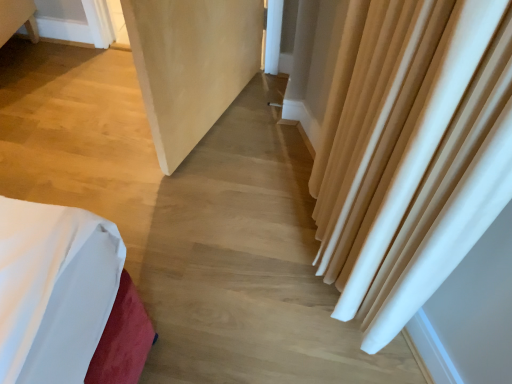
This screenshot has height=384, width=512. What do you see at coordinates (191, 65) in the screenshot? I see `matte white screen door at center` at bounding box center [191, 65].

Find the location of `matte white screen door at center`. matte white screen door at center is located at coordinates (191, 65).

This screenshot has height=384, width=512. What are the coordinates of `beige fabric curtain at right` in the screenshot? It's located at (411, 154).

This screenshot has height=384, width=512. What do you see at coordinates (411, 154) in the screenshot? I see `beige fabric curtain at right` at bounding box center [411, 154].

The width and height of the screenshot is (512, 384). In order to click on matte white screen door at center in this screenshot , I will do `click(191, 65)`.

Does matte white screen door at center appear on the left side of beige fabric curtain at right?

Correct, you'll find matte white screen door at center to the left of beige fabric curtain at right.

In the image, is matte white screen door at center positioned in front of or behind beige fabric curtain at right?

Visually, matte white screen door at center is located in front of beige fabric curtain at right.

Considering the points (198, 118) and (489, 223), which point is in front, point (198, 118) or point (489, 223)?

Point (489, 223)

From the image's perspective, is matte white screen door at center below beige fabric curtain at right?

Incorrect, from the image's perspective, matte white screen door at center is higher than beige fabric curtain at right.

From a real-world perspective, is matte white screen door at center positioned under beige fabric curtain at right based on gravity?

Incorrect, from a real-world perspective, matte white screen door at center is higher than beige fabric curtain at right.

Which object is thinner, matte white screen door at center or beige fabric curtain at right?

beige fabric curtain at right.

Considering the sizes of objects matte white screen door at center and beige fabric curtain at right in the image provided, who is taller, matte white screen door at center or beige fabric curtain at right?

With more height is matte white screen door at center.

Based on their sizes in the image, would you say matte white screen door at center is bigger or smaller than beige fabric curtain at right?

matte white screen door at center is bigger than beige fabric curtain at right.

Is matte white screen door at center spatially inside beige fabric curtain at right, or outside of it?

matte white screen door at center is outside beige fabric curtain at right.

Is matte white screen door at center next to beige fabric curtain at right?

They are not placed beside each other.

Is matte white screen door at center aimed at beige fabric curtain at right?

No, matte white screen door at center is not aimed at beige fabric curtain at right.

What's the angular difference between matte white screen door at center and beige fabric curtain at right's facing directions?

The facing directions of matte white screen door at center and beige fabric curtain at right are 43.4 degrees apart.

How distant is matte white screen door at center from beige fabric curtain at right?

They are 31.48 inches apart.

Where is `curtain below the matte white screen door at center (from the image's perspective)`? This screenshot has height=384, width=512. curtain below the matte white screen door at center (from the image's perspective) is located at coordinates (411, 154).

Consider the image. Does beige fabric curtain at right appear on the left side of matte white screen door at center?

No, beige fabric curtain at right is not to the left of matte white screen door at center.

Considering their positions, is beige fabric curtain at right located in front of or behind matte white screen door at center?

beige fabric curtain at right is positioned farther from the viewer than matte white screen door at center.

Does point (441, 165) appear closer or farther from the camera than point (174, 30)?

Point (441, 165) is positioned closer to the camera compared to point (174, 30).

From the image's perspective, does beige fabric curtain at right appear lower than matte white screen door at center?

Indeed, from the image's perspective, beige fabric curtain at right is shown beneath matte white screen door at center.

From a real-world perspective, is beige fabric curtain at right positioned over matte white screen door at center based on gravity?

No, from a real-world perspective, beige fabric curtain at right is not over matte white screen door at center

Is beige fabric curtain at right wider or thinner than matte white screen door at center?

In the image, beige fabric curtain at right appears to be more narrow than matte white screen door at center.

Is beige fabric curtain at right taller than matte white screen door at center?

Incorrect, the height of beige fabric curtain at right is not larger of that of matte white screen door at center.

Is beige fabric curtain at right bigger than matte white screen door at center?

Incorrect, beige fabric curtain at right is not larger than matte white screen door at center.

Would you say beige fabric curtain at right is inside or outside matte white screen door at center?

beige fabric curtain at right is not inside matte white screen door at center, it's outside.

Is beige fabric curtain at right far away from matte white screen door at center?

beige fabric curtain at right is near matte white screen door at center, not far away.

Based on the photo, is beige fabric curtain at right aimed at matte white screen door at center?

No.

How many degrees apart are the facing directions of beige fabric curtain at right and matte white screen door at center?

The facing directions of beige fabric curtain at right and matte white screen door at center are 43.4 degrees apart.

How much distance is there between beige fabric curtain at right and matte white screen door at center?

The distance of beige fabric curtain at right from matte white screen door at center is 31.48 inches.

Identify the location of curtain that appears behind the matte white screen door at center. (411, 154).

Identify the location of screen door above the beige fabric curtain at right (from a real-world perspective). (191, 65).

Where is `screen door in front of the beige fabric curtain at right`? The height and width of the screenshot is (384, 512). screen door in front of the beige fabric curtain at right is located at coordinates (191, 65).